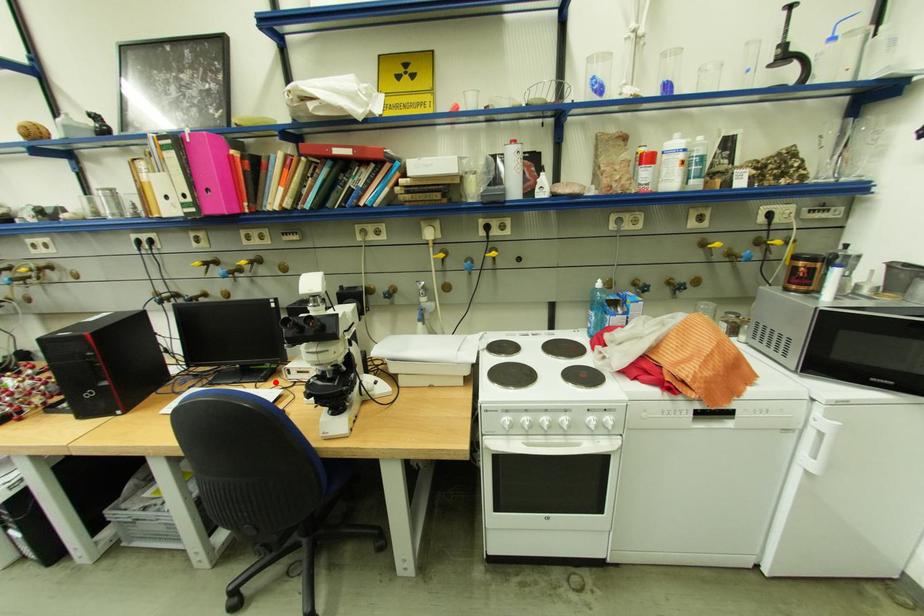
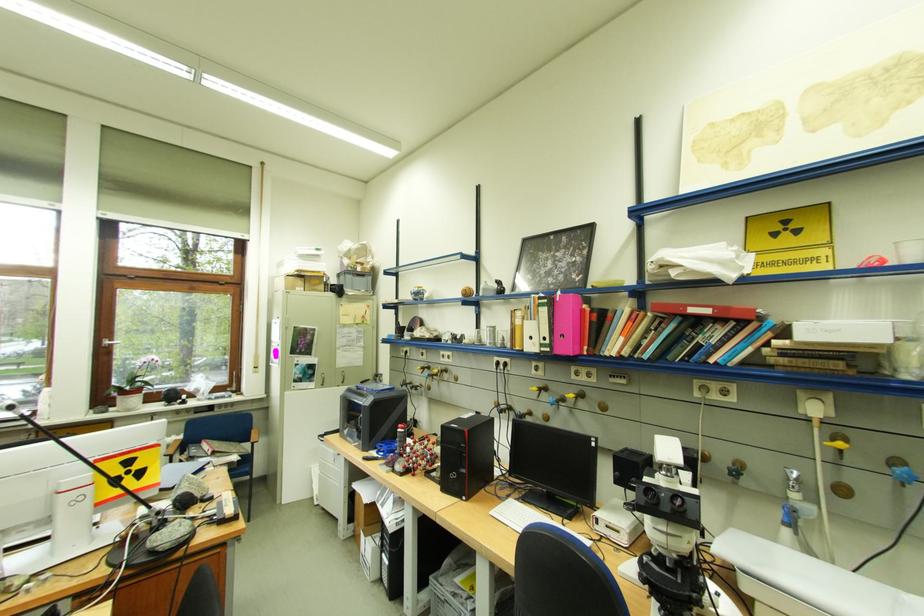
In the second image, find the point that corresponds to the highlighted location in the first image.

(580, 521)